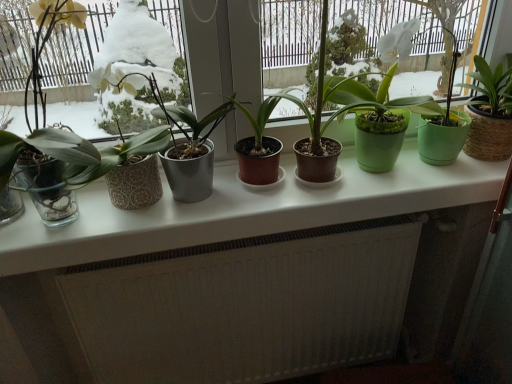
Where is `free space in front of brown matte pot at center, which is the third houseplant from right to left`? The image size is (512, 384). free space in front of brown matte pot at center, which is the third houseplant from right to left is located at coordinates (253, 210).